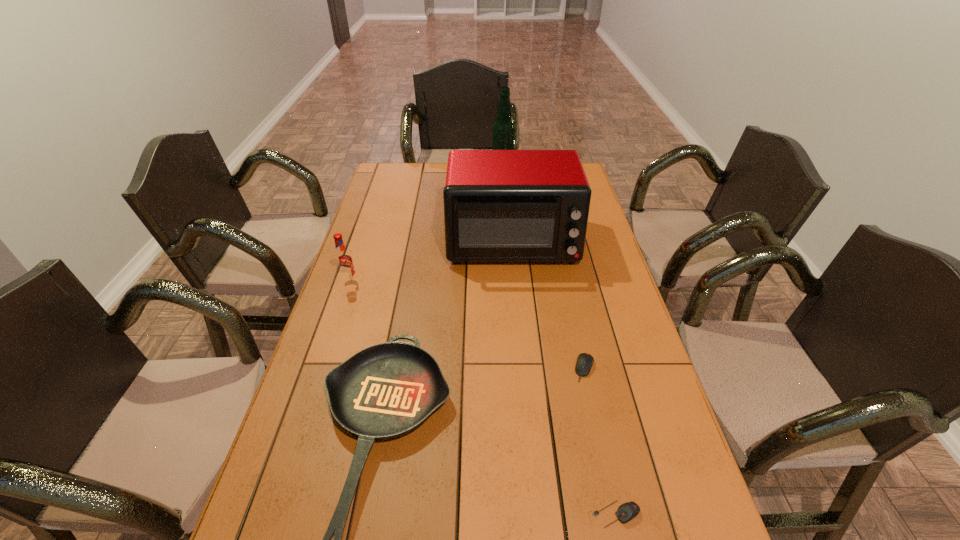
Image resolution: width=960 pixels, height=540 pixels. What are the coordinates of `the tallest object` in the screenshot? It's located at (503, 133).

The width and height of the screenshot is (960, 540). Identify the location of the farthest object. pos(503,133).

The image size is (960, 540). I want to click on toaster oven, so click(x=499, y=205).

I want to click on the fifth shortest object, so click(x=499, y=205).

The image size is (960, 540). Find the location of `the leftmost object`. the leftmost object is located at coordinates (343, 260).

This screenshot has width=960, height=540. In order to click on root beer in this screenshot , I will do `click(343, 260)`.

Identify the location of the taller mouse. (585, 361).

The image size is (960, 540). Identify the location of the farther mouse. tap(585, 361).

What are the coordinates of `the nearer mouse` in the screenshot? It's located at (626, 512).

Where is `the shorter mouse`? This screenshot has width=960, height=540. the shorter mouse is located at coordinates (626, 512).